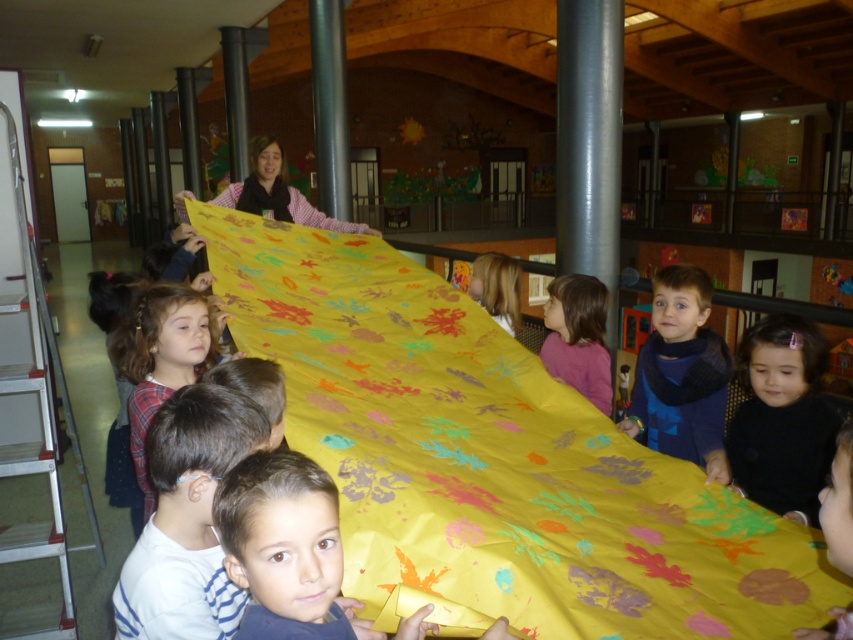
Between plaid fabric at center and blonde hair at center, which one appears on the right side from the viewer's perspective?

blonde hair at center

Who is more forward, [167,291] or [498,307]?

Point [167,291] is in front.

Does point (132, 301) lie behind point (503, 321)?

That is False.

Locate an element on the screen. plaid fabric at center is located at coordinates (161, 358).

Does point (142, 592) come closer to viewer compared to point (735, 442)?

Yes, it is.

Does white striped shirt at lower center have a smaller size compared to black matte hairband at lower right?

Correct, white striped shirt at lower center occupies less space than black matte hairband at lower right.

Who is more distant from viewer, (218, 452) or (790, 320)?

The point (790, 320) is more distant.

Locate an element on the screen. This screenshot has height=640, width=853. white striped shirt at lower center is located at coordinates (187, 518).

Can you confirm if pink fabric at center is positioned to the left of blonde hair at center?

In fact, pink fabric at center is to the right of blonde hair at center.

Who is higher up, pink fabric at center or blonde hair at center?

blonde hair at center

Which is in front, point (563, 317) or point (483, 292)?

Point (563, 317) is more forward.

The width and height of the screenshot is (853, 640). Find the location of `pink fabric at center`. pink fabric at center is located at coordinates (578, 337).